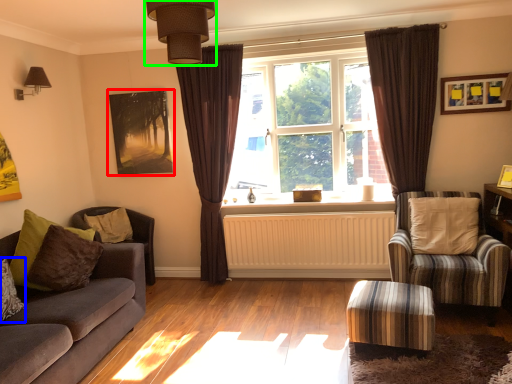
Question: Which is nearer to the picture frame (highlighted by a red box)? pillow (highlighted by a blue box) or light fixture (highlighted by a green box).

Choices:
 (A) pillow
 (B) light fixture

Answer: (A)